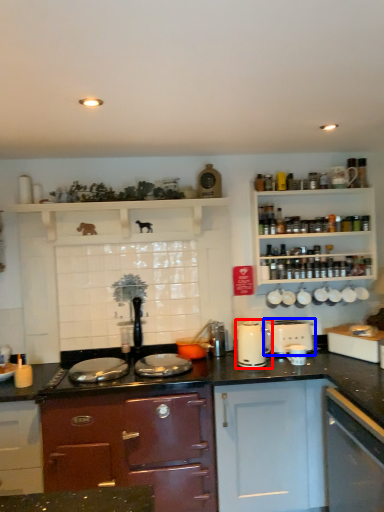
Question: Which of the following is the farthest to the observer, kitchen appliance (highlighted by a red box) or toaster (highlighted by a blue box)?

Choices:
 (A) kitchen appliance
 (B) toaster

Answer: (B)